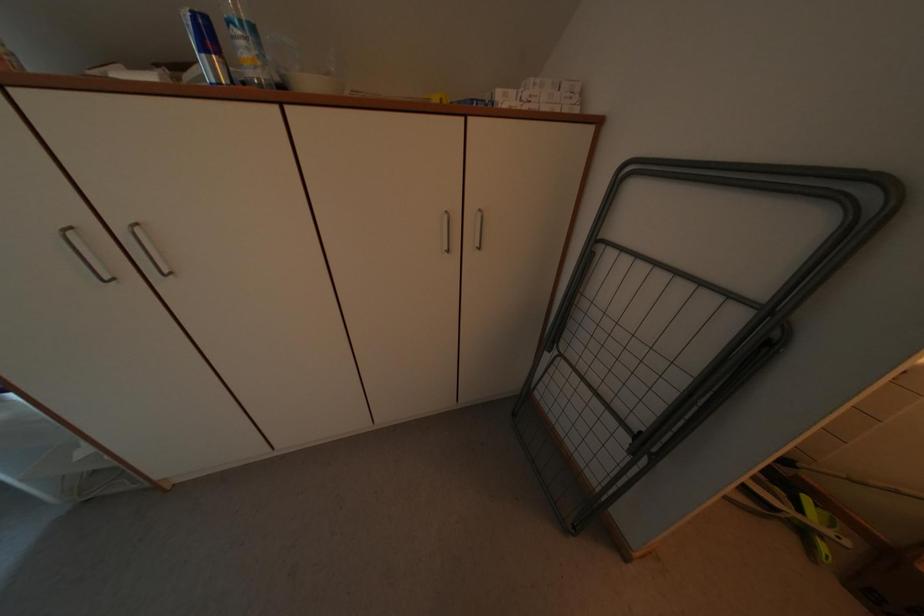
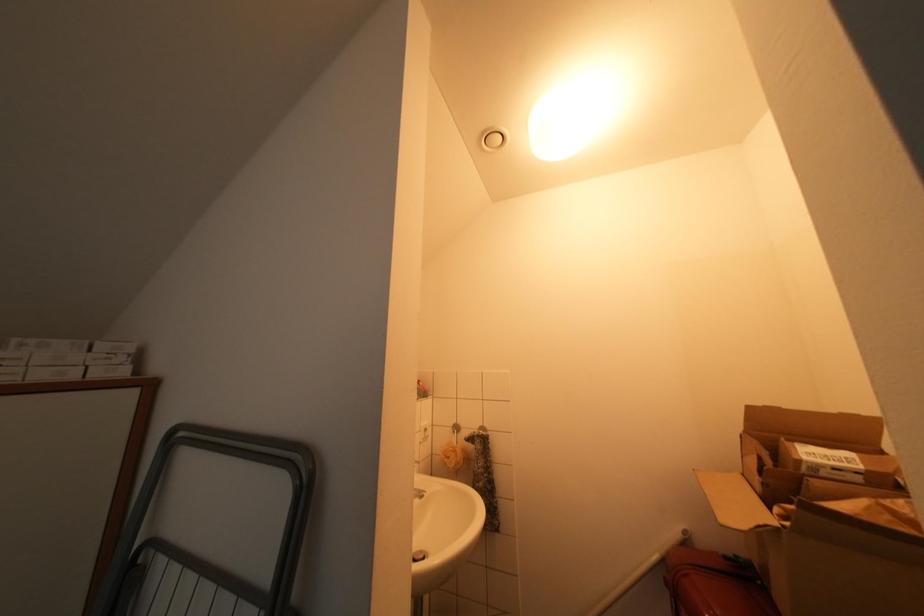
First-person continuous shooting, in which direction is the camera rotating?

The camera's rotation is toward right-up.